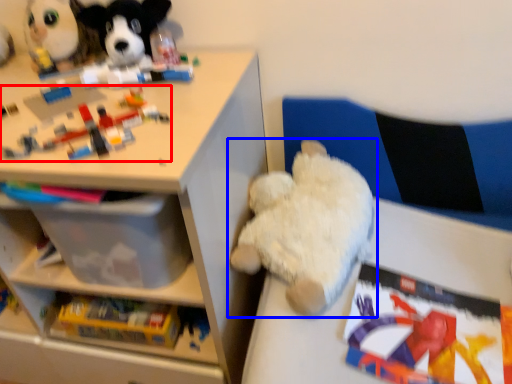
Question: Which of the following is the closest to the observer, toy (highlighted by a red box) or toy (highlighted by a blue box)?

Choices:
 (A) toy
 (B) toy

Answer: (A)